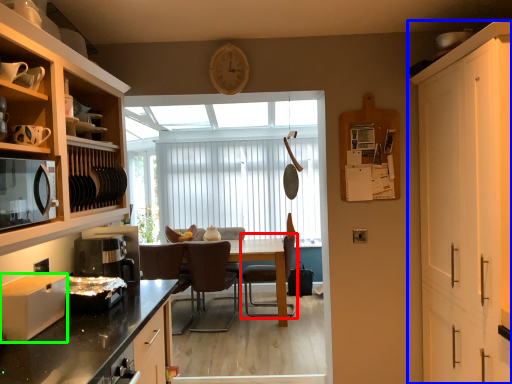
Question: Considering the real-world distances, which object is farthest from chair (highlighted by a red box)? cabinetry (highlighted by a blue box) or appliance (highlighted by a green box)?

Choices:
 (A) cabinetry
 (B) appliance

Answer: (B)